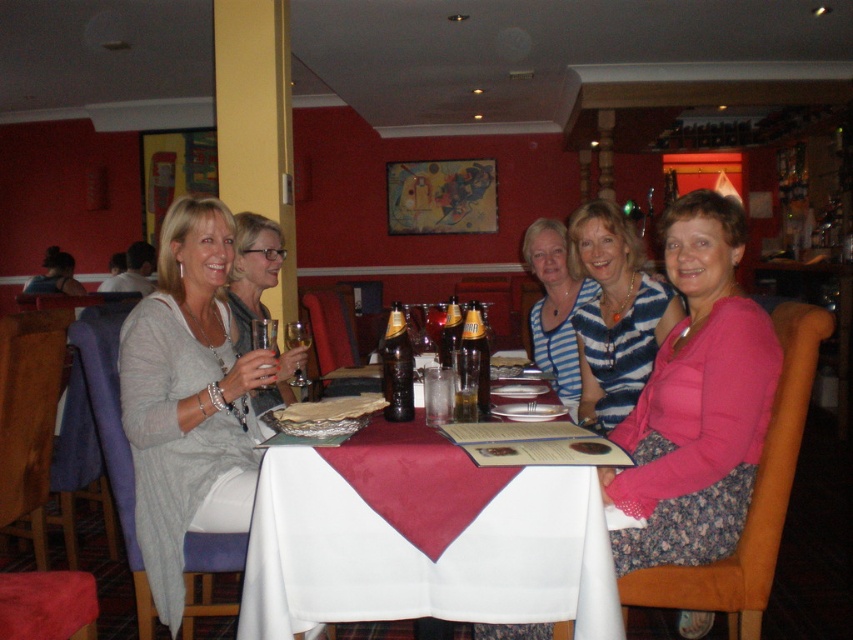
Question: Which of the following is the closest to the observer?

Choices:
 (A) matte gray sweater at center
 (B) white satin table at center
 (C) light gray knit cardigan at left
 (D) brown glass bottle at table center

Answer: (B)

Question: Which point appears closest to the camera in this image?

Choices:
 (A) (544, 244)
 (B) (669, 307)

Answer: (B)

Question: Can you confirm if light gray knit cardigan at left is thinner than smooth brown bread at table center?

Choices:
 (A) no
 (B) yes

Answer: (A)

Question: Is light gray knit cardigan at left to the left of matte gray sweater at center from the viewer's perspective?

Choices:
 (A) yes
 (B) no

Answer: (A)

Question: In this image, where is striped knit top at center located relative to striped knit sweater at center?

Choices:
 (A) left
 (B) right

Answer: (B)

Question: Based on their relative distances, which object is farther from the smooth brown bread at table center?

Choices:
 (A) white satin table at center
 (B) striped knit top at center

Answer: (B)